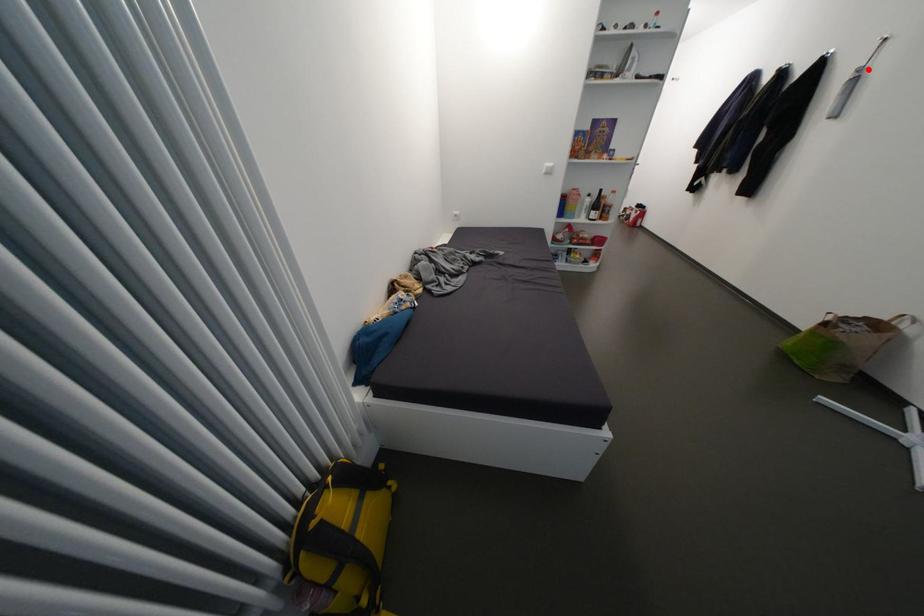
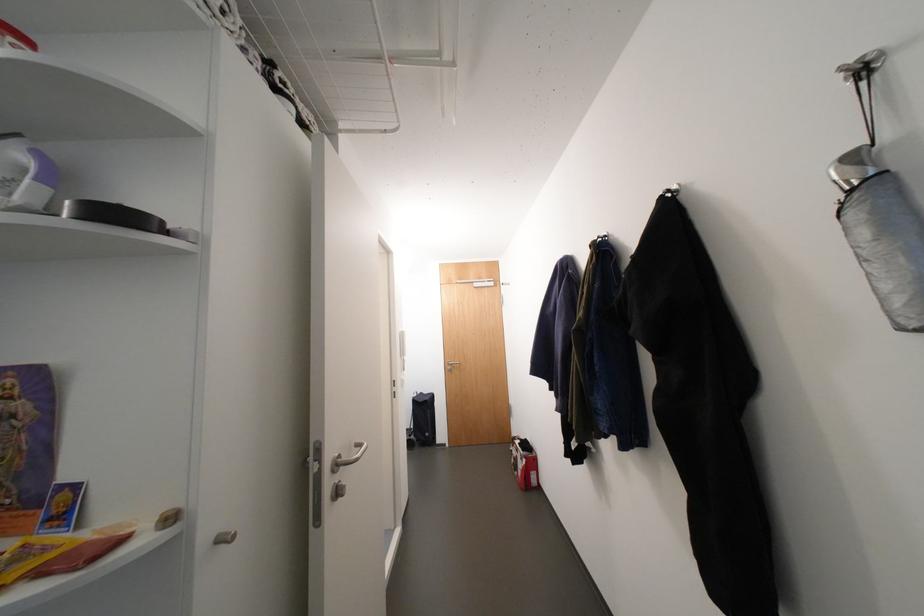
The point at the highlighted location is marked in the first image. Where is the corresponding point in the second image?

(864, 159)